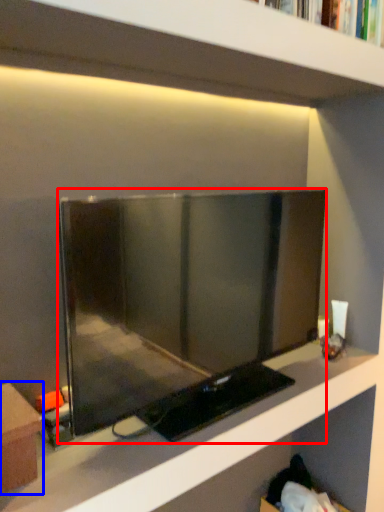
Question: Which object is further to the camera taking this photo, television (highlighted by a red box) or furniture (highlighted by a blue box)?

Choices:
 (A) television
 (B) furniture

Answer: (A)